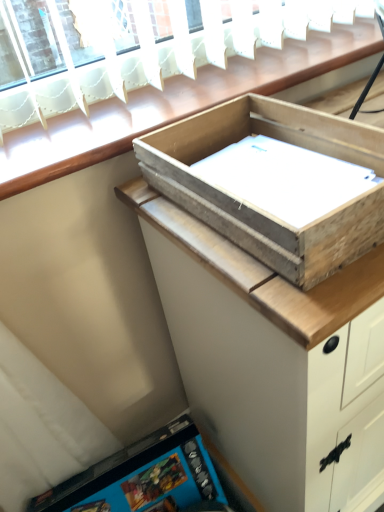
Question: From a real-world perspective, is weathered wood box at upper center positioned above or below wooden tray at upper center?

Choices:
 (A) above
 (B) below

Answer: (A)

Question: In the image, is weathered wood box at upper center positioned in front of or behind wooden tray at upper center?

Choices:
 (A) behind
 (B) front

Answer: (B)

Question: Is weathered wood box at upper center wider or thinner than wooden tray at upper center?

Choices:
 (A) thin
 (B) wide

Answer: (A)

Question: Looking at their shapes, would you say wooden tray at upper center is wider or thinner than weathered wood box at upper center?

Choices:
 (A) thin
 (B) wide

Answer: (B)

Question: Considering the positions of wooden tray at upper center and weathered wood box at upper center in the image, is wooden tray at upper center bigger or smaller than weathered wood box at upper center?

Choices:
 (A) big
 (B) small

Answer: (A)

Question: From a real-world perspective, is wooden tray at upper center physically located above or below weathered wood box at upper center?

Choices:
 (A) above
 (B) below

Answer: (B)

Question: Is point pyautogui.click(x=276, y=340) closer or farther from the camera than point pyautogui.click(x=362, y=220)?

Choices:
 (A) closer
 (B) farther

Answer: (B)